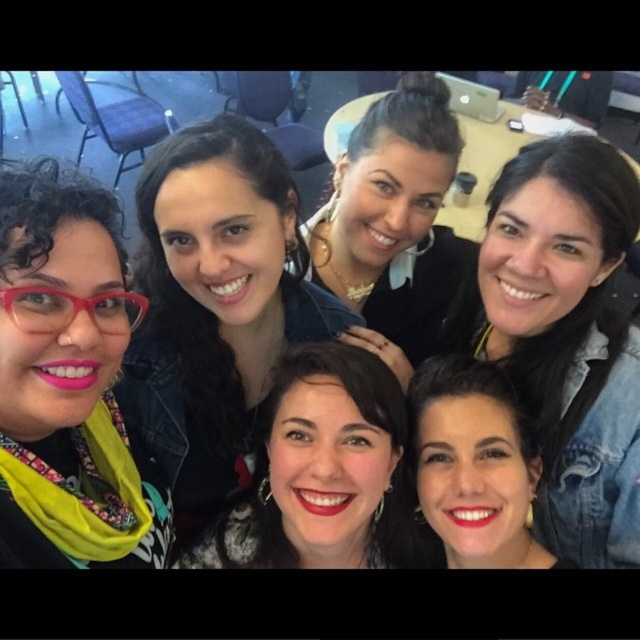
Does matte black jacket at upper left have a smaller size compared to denim jacket at upper right?

Indeed, matte black jacket at upper left has a smaller size compared to denim jacket at upper right.

Which of these two, matte black jacket at upper left or denim jacket at upper right, stands taller?

denim jacket at upper right

Does point (193, 220) lie in front of point (628, 436)?

Yes, point (193, 220) is closer to viewer.

Find the location of a particular element. This screenshot has width=640, height=640. matte black jacket at upper left is located at coordinates (216, 307).

Measure the distance from yellow fabric scarf at left to smooth skin at center.

yellow fabric scarf at left and smooth skin at center are 48.12 centimeters apart from each other.

Which of these two, yellow fabric scarf at left or smooth skin at center, stands taller?

yellow fabric scarf at left

What do you see at coordinates (67, 380) in the screenshot? This screenshot has height=640, width=640. I see `yellow fabric scarf at left` at bounding box center [67, 380].

Locate an element on the screen. The image size is (640, 640). yellow fabric scarf at left is located at coordinates (67, 380).

Looking at this image, is denim jacket at upper right to the right of yellow fabric scarf at left from the viewer's perspective?

Correct, you'll find denim jacket at upper right to the right of yellow fabric scarf at left.

This screenshot has height=640, width=640. What do you see at coordinates (564, 336) in the screenshot?
I see `denim jacket at upper right` at bounding box center [564, 336].

Where is `denim jacket at upper right`? denim jacket at upper right is located at coordinates (564, 336).